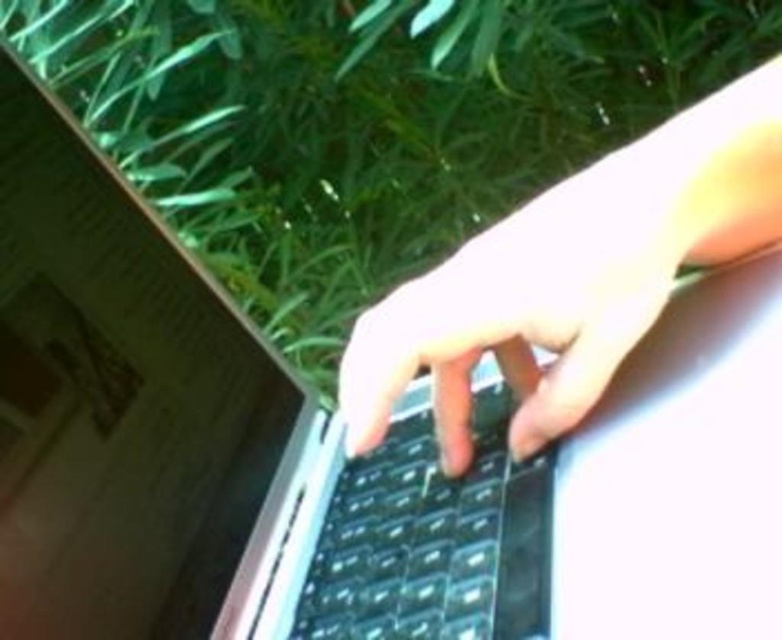
Question: Does sleek silver laptop at center have a smaller size compared to black plastic keyboard at center?

Choices:
 (A) no
 (B) yes

Answer: (A)

Question: Which object is closer to the camera taking this photo?

Choices:
 (A) satin black hand at center
 (B) black plastic keyboard at center

Answer: (B)

Question: Is the position of sleek silver laptop at center less distant than that of black plastic keyboard at center?

Choices:
 (A) no
 (B) yes

Answer: (B)

Question: Among these objects, which one is nearest to the camera?

Choices:
 (A) sleek silver laptop at center
 (B) satin black hand at center

Answer: (A)

Question: Which of the following is the farthest from the observer?

Choices:
 (A) sleek silver laptop at center
 (B) satin black hand at center

Answer: (B)

Question: Does sleek silver laptop at center come behind satin black hand at center?

Choices:
 (A) yes
 (B) no

Answer: (B)